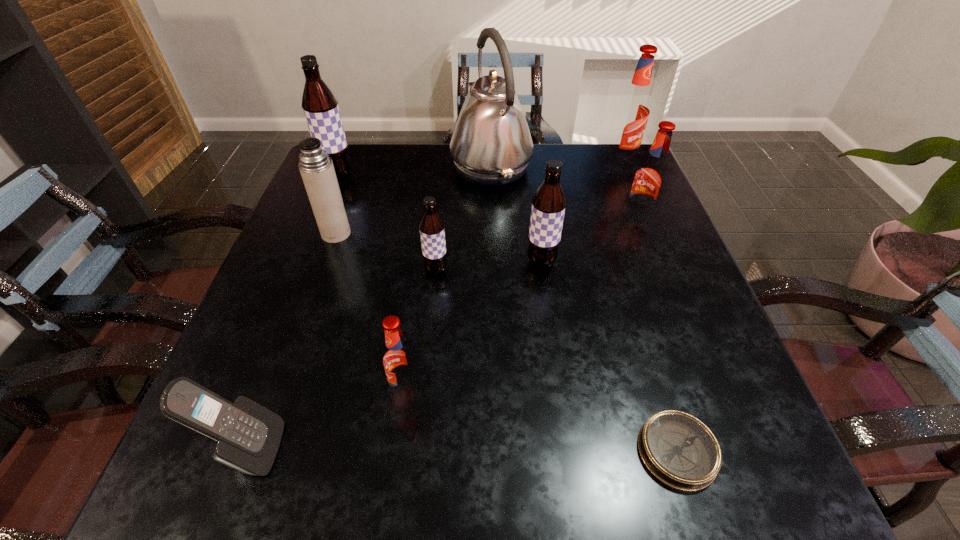
At what (x,y) coordinates should I click in order to perform the action: click on vacant space that satisfies the following two spatial constraints: 1. on the front side of the leftmost root beer; 2. on the left side of the compass. Please return your answer as a coordinate pair (x, y). Looking at the image, I should click on (228, 451).

This screenshot has height=540, width=960. I want to click on vacant region that satisfies the following two spatial constraints: 1. on the front side of the rightmost brown root beer; 2. on the front-facing side of the cellular telephone, so click(567, 449).